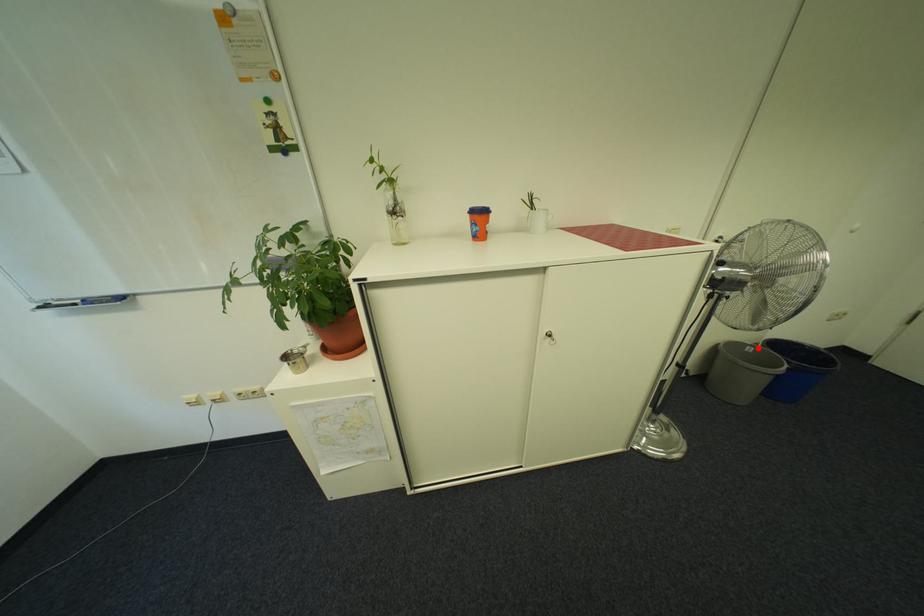
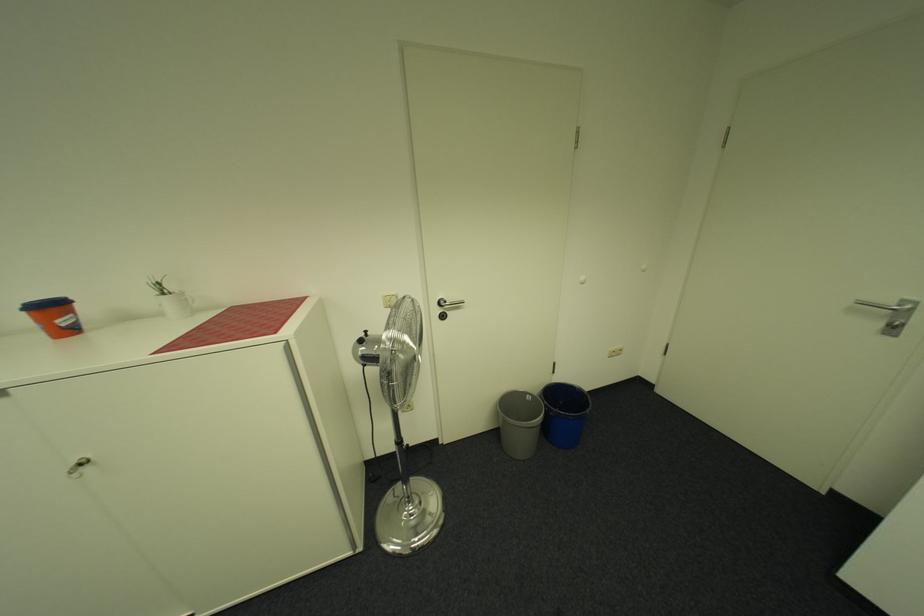
Locate, in the second image, the point that corresponds to the highlighted location in the first image.

(538, 397)